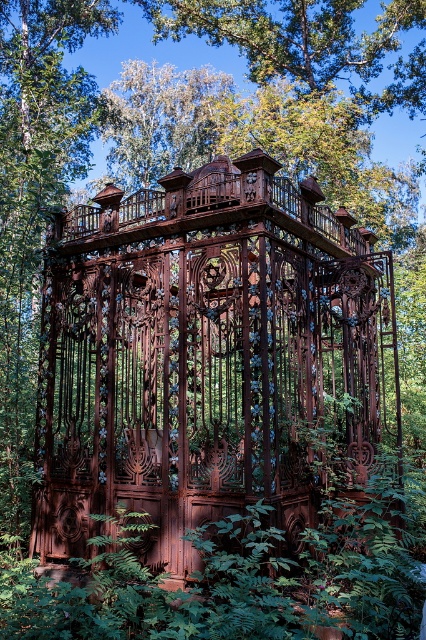
You are standing at the camera position and want to take a photo of the rusty metal gazebo at center. If your camera has a maximum focus range of 6 meters, will you be able to capture the gazebo clearly?

The rusty metal gazebo at center and camera are 6.49 meters apart from each other. Since the distance exceeds the camera maximum focus range of 6 meters, you cannot capture the gazebo clearly.

You are a hiker who wants to take a photo of the green leafy foliage at center without the rusty metal gazebo at center blocking the view. Is there a way to do this by moving your position?

The rusty metal gazebo at center is positioned over green leafy foliage at center, so moving to a position where the gazebo is not between you and the foliage would allow an unobstructed view. For example, moving to the side or behind the foliage might work.

You are standing in the forest and see the point marked at coordinates (x=210, y=358). What object is located at that point?

The point at coordinates (x=210, y=358) corresponds to the rusty metal gazebo at center.